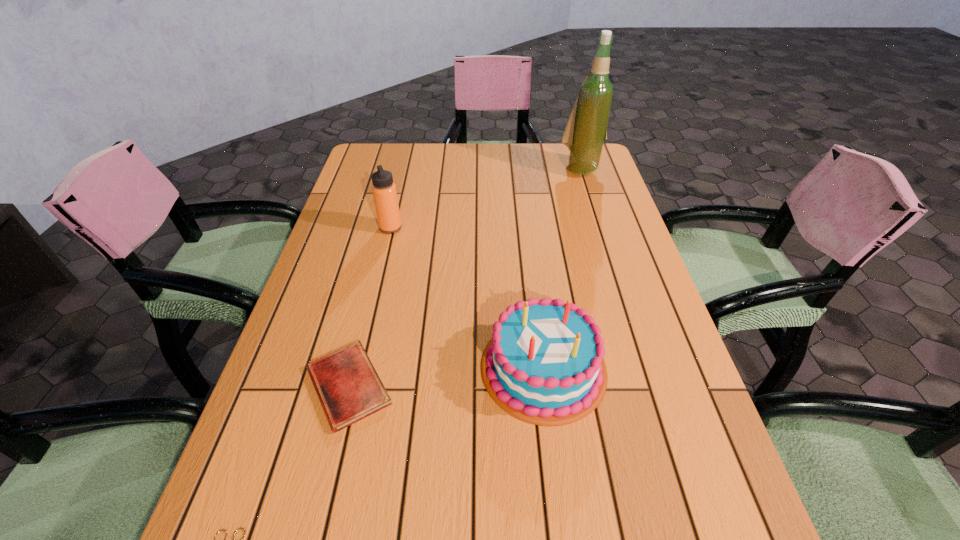
You are a GUI agent. You are given a task and a screenshot of the screen. Output one action in this format:
    pyautogui.click(x=<x>, y=<y>)
    Task: Click on the object that is the closest to the farthest object
    The height and width of the screenshot is (540, 960).
    Given the screenshot: What is the action you would take?
    pyautogui.click(x=384, y=191)

Where is `object that ranks as the fourth closest to the second farthest object`? The width and height of the screenshot is (960, 540). object that ranks as the fourth closest to the second farthest object is located at coordinates (240, 528).

You are a GUI agent. You are given a task and a screenshot of the screen. Output one action in this format:
    pyautogui.click(x=<x>, y=<y>)
    Task: Click on the free space that satisfies the following two spatial constraints: 1. on the back side of the fourth nearest object; 2. on the right side of the fourth tallest object
    This screenshot has height=540, width=960.
    Given the screenshot: What is the action you would take?
    pyautogui.click(x=387, y=228)

Where is `vacant region that satisfies the following two spatial constraints: 1. on the front side of the birthday cake; 2. on the right side of the thermos bottle`? vacant region that satisfies the following two spatial constraints: 1. on the front side of the birthday cake; 2. on the right side of the thermos bottle is located at coordinates (357, 368).

At what (x,y) coordinates should I click in order to perform the action: click on free space that satisfies the following two spatial constraints: 1. on the back side of the fourth nearest object; 2. on the right side of the diary. Please return your answer as a coordinate pair (x, y). Looking at the image, I should click on (387, 228).